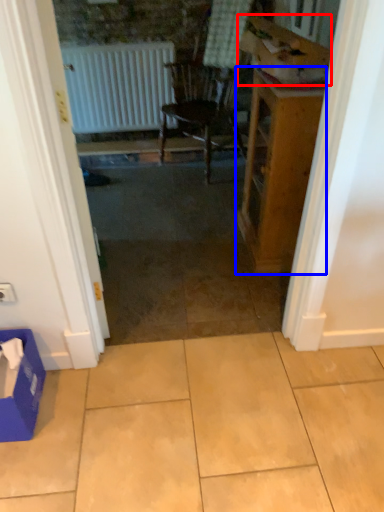
Question: Which of the following is the farthest to the observer, cardboard box (highlighted by a red box) or table (highlighted by a blue box)?

Choices:
 (A) cardboard box
 (B) table

Answer: (B)